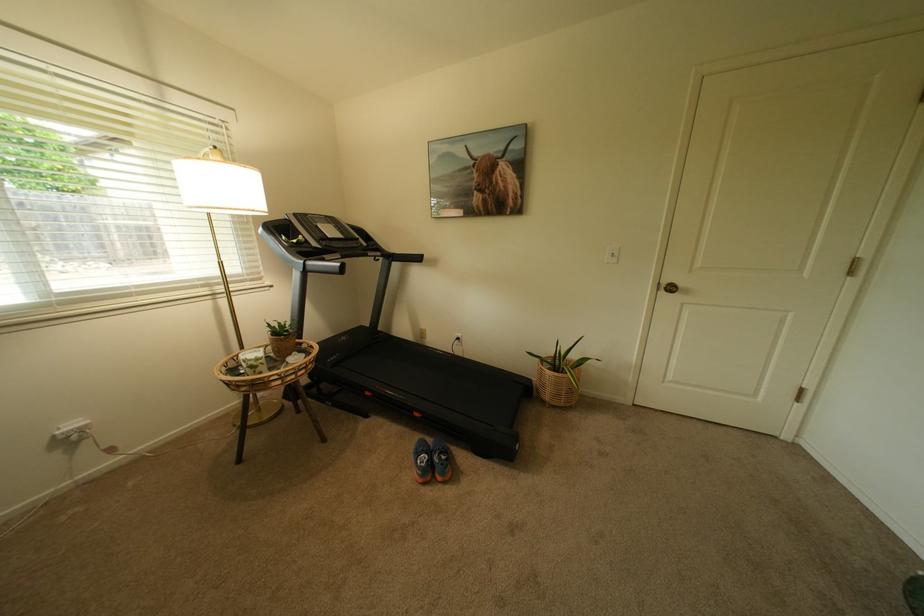
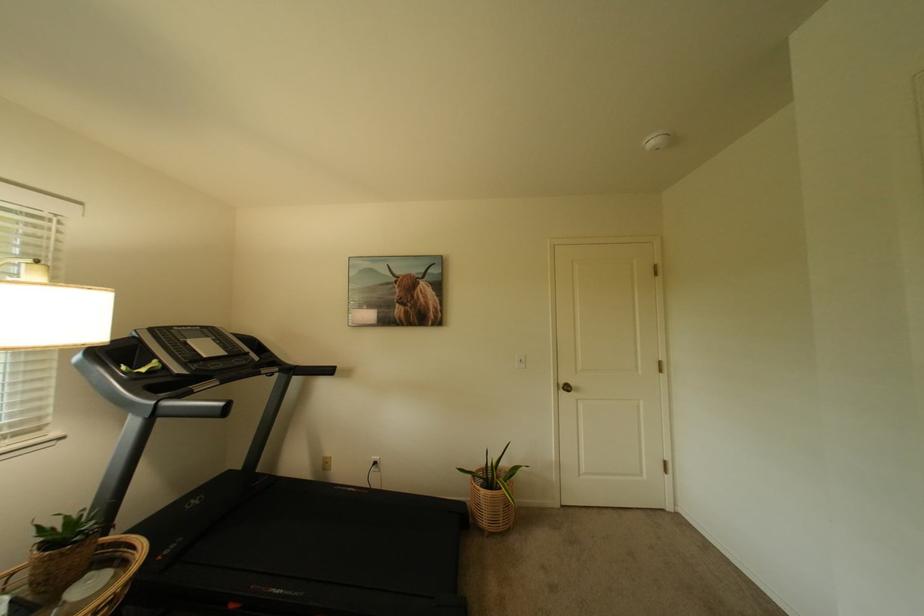
Where in the second image is the point corresponding to (402,254) from the first image?

(305, 368)